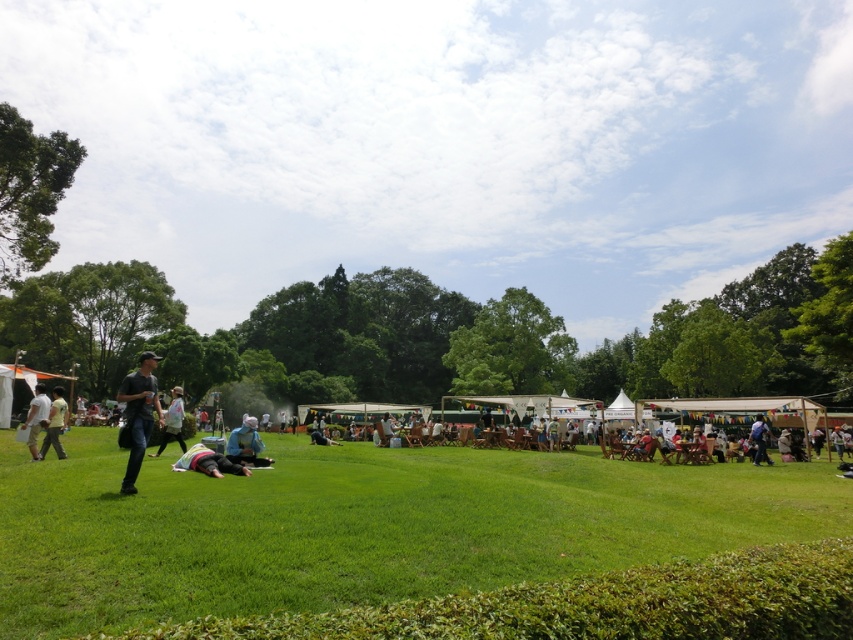
Question: Is green grassy field at center wider than blue fabric at center?

Choices:
 (A) no
 (B) yes

Answer: (B)

Question: Where is dark gray casual wear at left located in relation to light blue denim jacket at center in the image?

Choices:
 (A) left
 (B) right

Answer: (B)

Question: Is white cotton shirt at left bigger than dark gray jeans at lower left?

Choices:
 (A) no
 (B) yes

Answer: (B)

Question: Which object appears farthest from the camera in this image?

Choices:
 (A) light blue denim jacket at center
 (B) green grassy field at center
 (C) light blue fabric at center

Answer: (A)

Question: Which point is closer to the camera?

Choices:
 (A) (180, 438)
 (B) (28, 445)
 (C) (50, 436)

Answer: (B)

Question: Which object is positioned closest to the green grassy field at center?

Choices:
 (A) blue fabric at center
 (B) white cotton shirt at left
 (C) dark gray casual wear at left

Answer: (A)